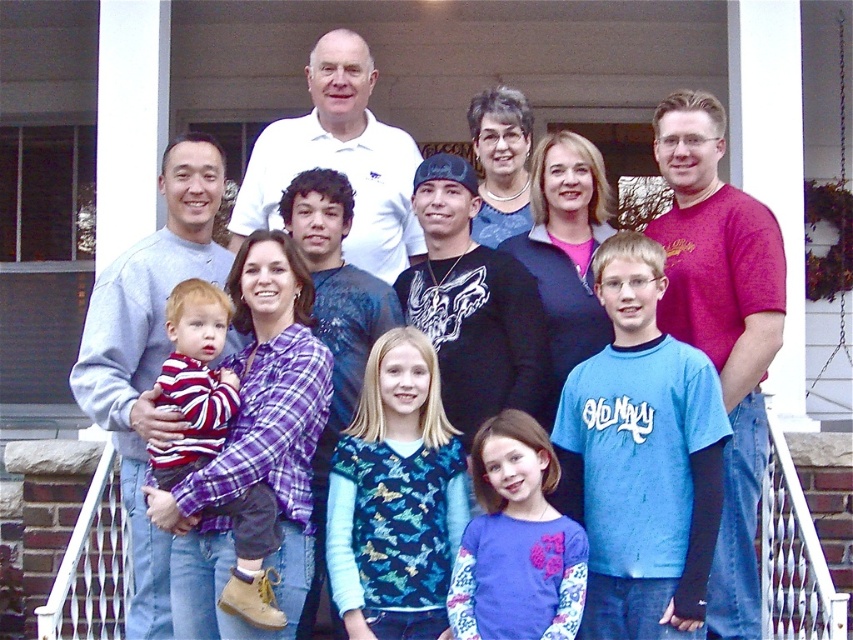
You are a photographer trying to adjust the lighting for a group photo on a porch. You notice two people in the front row wearing a blue printed sweater at center and a purple fleece shirt at center. Which of these two is shorter?

The blue printed sweater at center is shorter than the purple fleece shirt at center.

You are organizing a clothing donation drive and need to determine which of the two shirts, the white polo shirt at upper center or the striped cotton shirt at lower left, can fit into a donation box that has a width capacity of 40 cm. Based on their sizes, which shirt would you choose to place in the box first?

The white polo shirt at upper center has a smaller width than the striped cotton shirt at lower left. Since the donation box can only hold up to 40 cm in width, the white polo shirt at upper center is more likely to fit, so it should be placed in the box first.